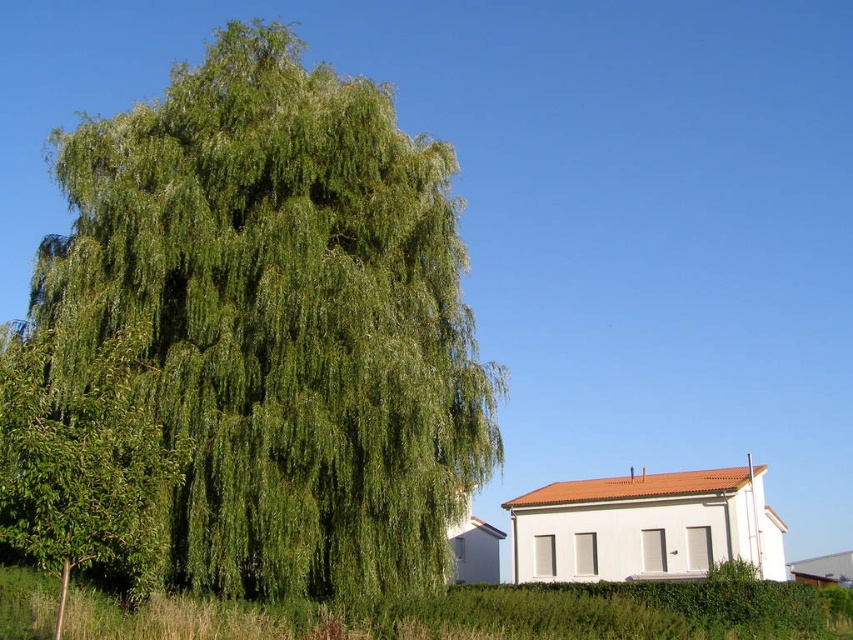
You are standing in the suburban scene and want to determine which tree is larger. You see the green leafy willow at left and the green leafy tree at left. Which one is larger?

The green leafy willow at left is bigger than the green leafy tree at left according to the description provided.

You are standing in the suburban scene and want to determine which tree is taller between the green leafy willow at left and the green leafy tree at left. Which one is taller?

The green leafy willow at left is taller than the green leafy tree at left according to the description provided.